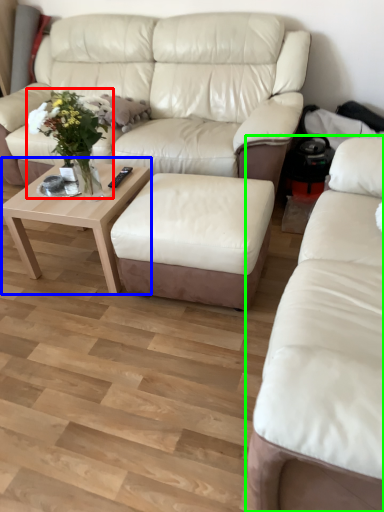
Question: Estimate the real-world distances between objects in this image. Which object is farther from floral arrangement (highlighted by a red box), coffee table (highlighted by a blue box) or studio couch (highlighted by a green box)?

Choices:
 (A) coffee table
 (B) studio couch

Answer: (B)